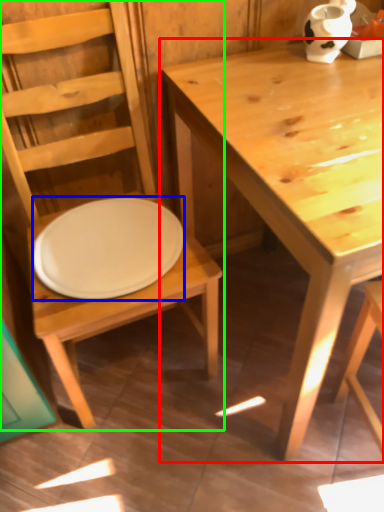
Question: Which object is the farthest from table (highlighted by a red box)? Choose among these: plate (highlighted by a blue box) or chair (highlighted by a green box).

Choices:
 (A) plate
 (B) chair

Answer: (A)